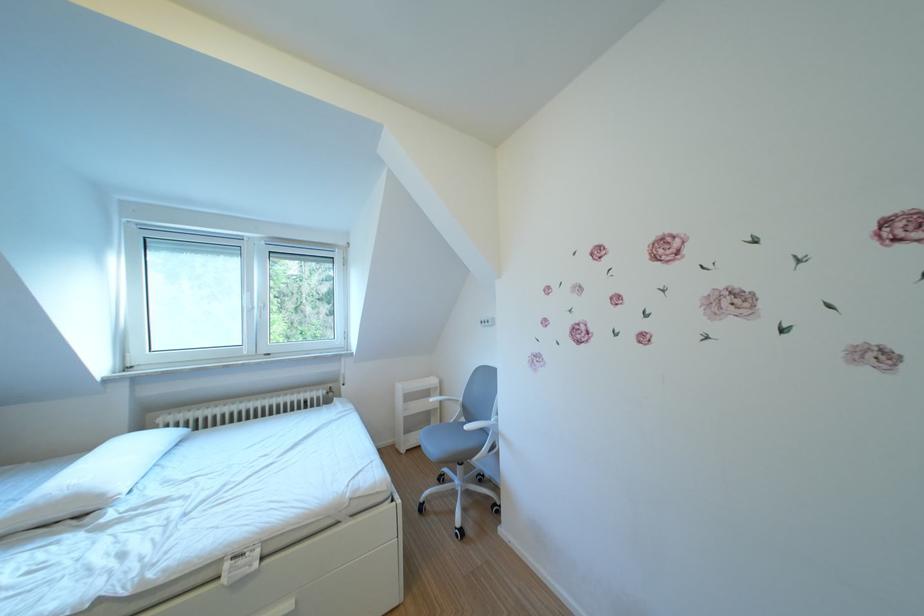
At what (x,y) coordinates should I click in order to perform the action: click on white pillow. Please return your answer as a coordinate pair (x, y). This screenshot has height=616, width=924. Looking at the image, I should click on (90, 480).